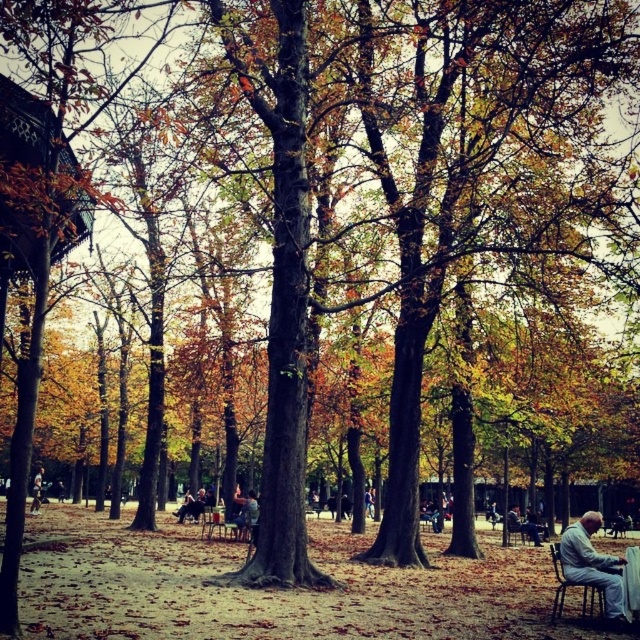
You are standing at the center of the dirt path in the autumn scene. You want to sit down on the wooden chair at lower right. Which direction should you walk to reach it?

You should walk towards the lower right direction to reach the wooden chair at lower right.